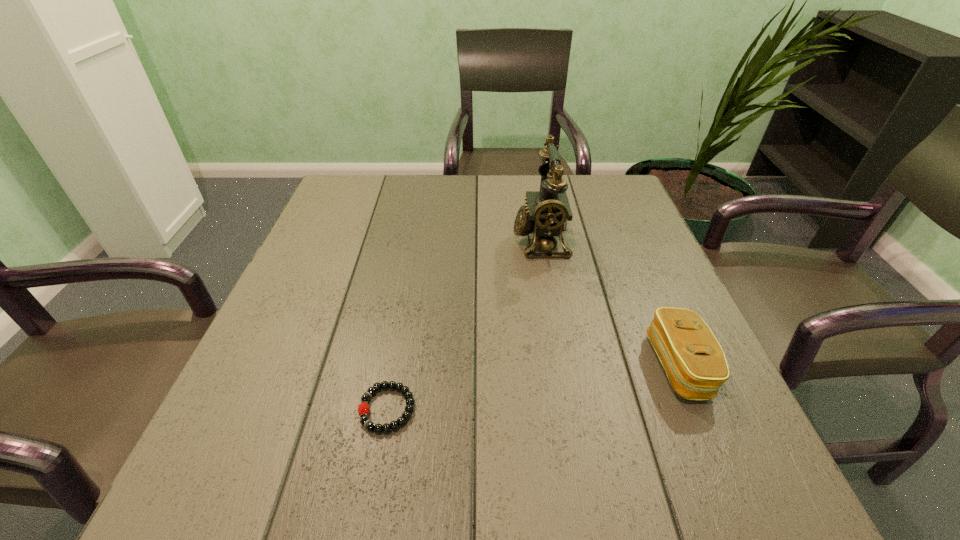
At what (x,y) coordinates should I click in order to perform the action: click on free space located on the zipper side of the clutch bag. Please return your answer as a coordinate pair (x, y). The image size is (960, 540). Looking at the image, I should click on (461, 366).

Locate an element on the screen. The width and height of the screenshot is (960, 540). vacant area situated 0.260m on the zipper side of the clutch bag is located at coordinates (506, 366).

Image resolution: width=960 pixels, height=540 pixels. In order to click on free region located on the back of the shortest object in this screenshot , I will do `click(398, 348)`.

Where is `object located at the far edge`? The width and height of the screenshot is (960, 540). object located at the far edge is located at coordinates (547, 212).

Find the location of a particular element. The width and height of the screenshot is (960, 540). object that is at the right edge is located at coordinates (694, 361).

The height and width of the screenshot is (540, 960). In the image, there is a desktop. What are the coordinates of `vacant space at the far edge` in the screenshot? It's located at point(460,198).

At what (x,y) coordinates should I click in order to perform the action: click on blank area at the near edge. Please return your answer as a coordinate pair (x, y). This screenshot has width=960, height=540. Looking at the image, I should click on (377, 488).

You are a GUI agent. You are given a task and a screenshot of the screen. Output one action in this format:
    pyautogui.click(x=<x>, y=<y>)
    Task: Click on the free region at the left edge of the desktop
    The height and width of the screenshot is (540, 960).
    Given the screenshot: What is the action you would take?
    [314, 256]

You are a GUI agent. You are given a task and a screenshot of the screen. Output one action in this format:
    pyautogui.click(x=<x>, y=<y>)
    Task: Click on the vacant space at the right edge of the desktop
    The image size is (960, 540).
    Given the screenshot: What is the action you would take?
    pyautogui.click(x=727, y=450)

In the image, there is a desktop. Identify the location of vacant space at the far left corner. (394, 180).